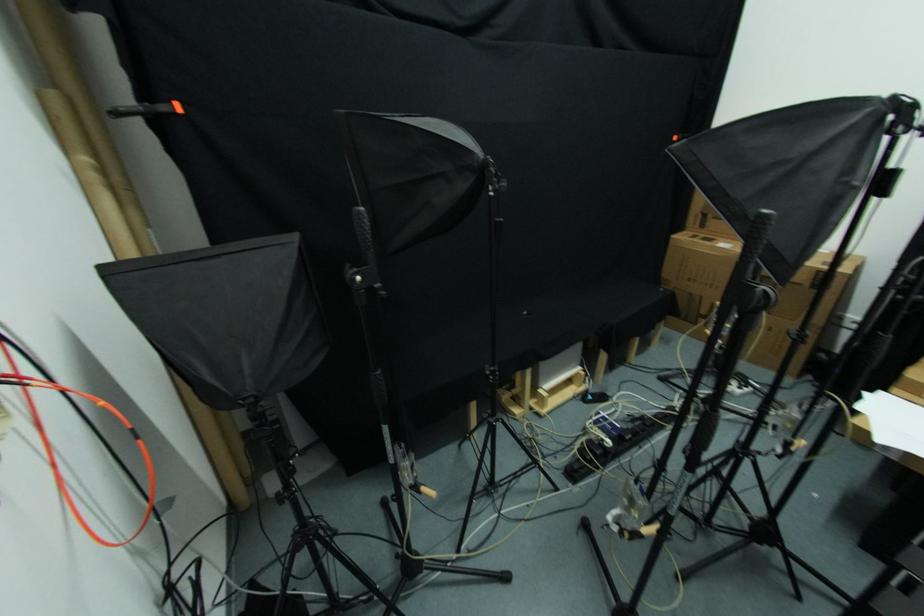
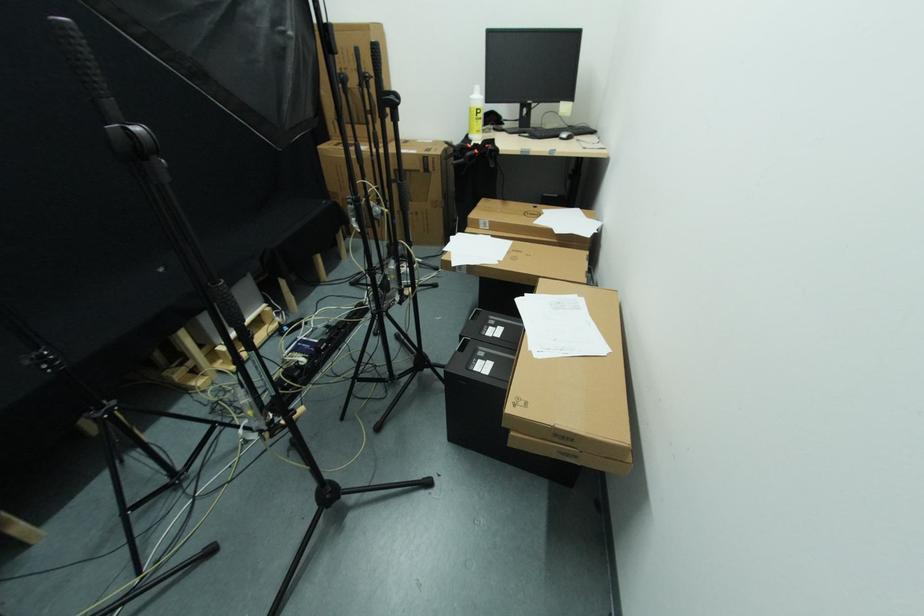
Where in the second image is the point corresponding to point (538, 406) from the first image?

(225, 365)